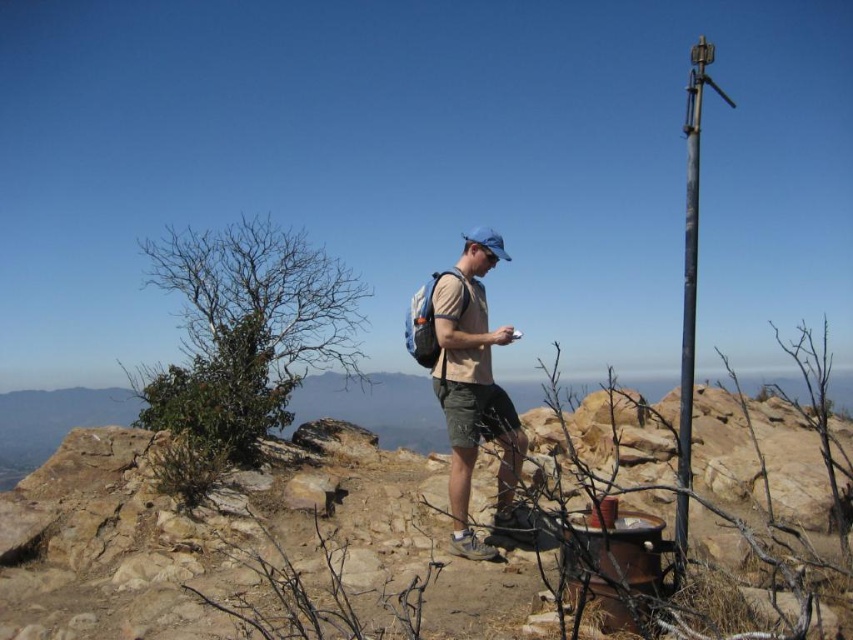
Is tan fabric shirt at center behind dark gray metallic pole at right?

No, it is in front of dark gray metallic pole at right.

Who is more forward, (490, 552) or (683, 224)?

Positioned in front is point (490, 552).

Find the location of a particular element. This screenshot has height=640, width=853. tan fabric shirt at center is located at coordinates (474, 392).

Can you confirm if brown rocky hill at center is smaller than dark gray metallic pole at right?

No.

Is point (434, 426) more distant than point (692, 400)?

That is True.

Where is `brown rocky hill at center`? The width and height of the screenshot is (853, 640). brown rocky hill at center is located at coordinates (376, 406).

Is brown rocky hill at center thinner than tan fabric shirt at center?

Incorrect, brown rocky hill at center's width is not less than tan fabric shirt at center's.

Describe the element at coordinates (376, 406) in the screenshot. This screenshot has width=853, height=640. I see `brown rocky hill at center` at that location.

The image size is (853, 640). I want to click on brown rocky hill at center, so click(x=376, y=406).